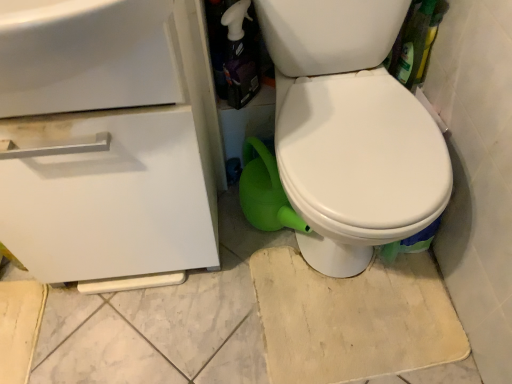
Question: Considering the relative sizes of white matte drawer at left and white glossy spray bottle at upper center in the image provided, is white matte drawer at left bigger than white glossy spray bottle at upper center?

Choices:
 (A) yes
 (B) no

Answer: (A)

Question: Does white matte drawer at left appear on the left side of white glossy spray bottle at upper center?

Choices:
 (A) no
 (B) yes

Answer: (B)

Question: Is white matte drawer at left thinner than white glossy spray bottle at upper center?

Choices:
 (A) no
 (B) yes

Answer: (A)

Question: Is white glossy spray bottle at upper center at the back of white matte drawer at left?

Choices:
 (A) yes
 (B) no

Answer: (B)

Question: Does white matte drawer at left come in front of white glossy spray bottle at upper center?

Choices:
 (A) no
 (B) yes

Answer: (B)

Question: Would you say white glossy sink at upper left is inside or outside white glossy spray bottle at upper center?

Choices:
 (A) inside
 (B) outside

Answer: (B)

Question: Is white glossy sink at upper left taller or shorter than white glossy spray bottle at upper center?

Choices:
 (A) tall
 (B) short

Answer: (B)

Question: In the image, is white glossy sink at upper left positioned in front of or behind white glossy spray bottle at upper center?

Choices:
 (A) front
 (B) behind

Answer: (A)

Question: From the image's perspective, relative to white glossy spray bottle at upper center, is white glossy sink at upper left above or below?

Choices:
 (A) below
 (B) above

Answer: (A)

Question: Is white glossy sink at upper left to the left or to the right of white matte drawer at left in the image?

Choices:
 (A) left
 (B) right

Answer: (B)

Question: From a real-world perspective, is white glossy sink at upper left physically located above or below white matte drawer at left?

Choices:
 (A) below
 (B) above

Answer: (B)

Question: Is white glossy sink at upper left situated inside white matte drawer at left or outside?

Choices:
 (A) inside
 (B) outside

Answer: (A)

Question: Considering the positions of white glossy sink at upper left and white matte drawer at left in the image, is white glossy sink at upper left bigger or smaller than white matte drawer at left?

Choices:
 (A) big
 (B) small

Answer: (B)

Question: Looking at the image, does white matte drawer at left seem bigger or smaller compared to white glossy spray bottle at upper center?

Choices:
 (A) big
 (B) small

Answer: (A)

Question: In terms of width, does white matte drawer at left look wider or thinner when compared to white glossy spray bottle at upper center?

Choices:
 (A) thin
 (B) wide

Answer: (B)